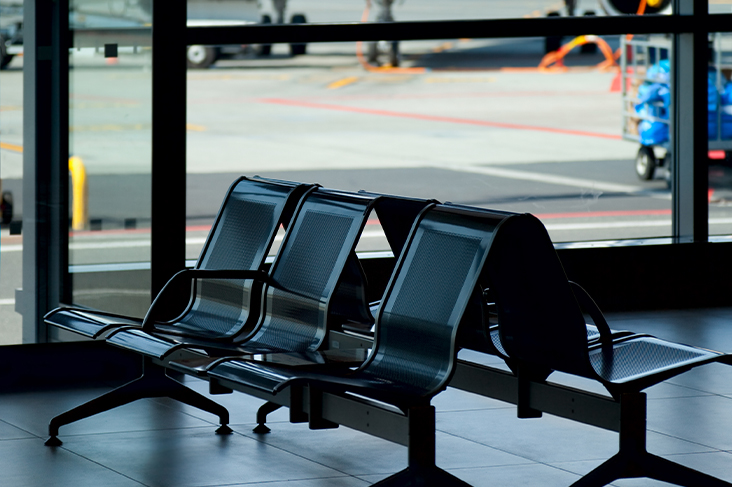
At what (x,y) coordinates should I click in order to perform the action: click on back of chairs. Please return your answer as a coordinate pair (x, y). Image resolution: width=732 pixels, height=487 pixels. Looking at the image, I should click on (447, 309), (324, 260), (238, 225).